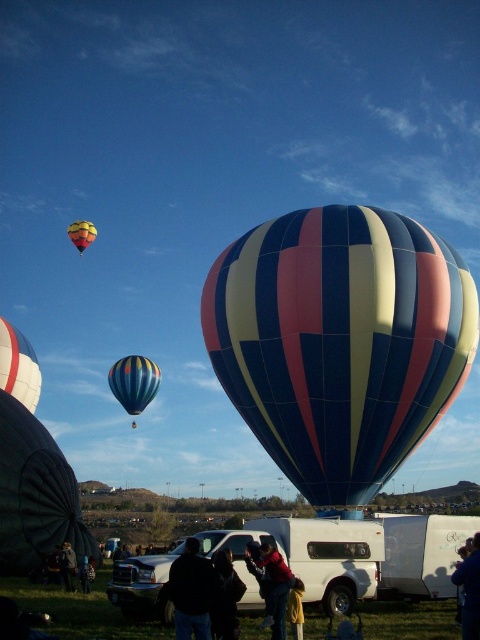
Question: Among these points, which one is farthest from the camera?

Choices:
 (A) (92, 580)
 (B) (115, 362)
 (C) (17, 380)

Answer: (B)

Question: Which point is closer to the camera taking this photo?

Choices:
 (A) (475, 550)
 (B) (96, 228)

Answer: (A)

Question: Which of the following is the farthest from the observer?

Choices:
 (A) (284, 573)
 (B) (478, 548)
 (C) (131, 368)
 (D) (468, 294)

Answer: (C)

Question: In this image, where is black fabric jacket at center located relative to dark gray jacket at lower left?

Choices:
 (A) below
 (B) above

Answer: (B)

Question: Is the position of multicolored striped balloon at center less distant than that of dark gray jacket at lower left?

Choices:
 (A) yes
 (B) no

Answer: (A)

Question: Is white glossy balloon at left thinner than dark blue jeans at lower center?

Choices:
 (A) no
 (B) yes

Answer: (A)